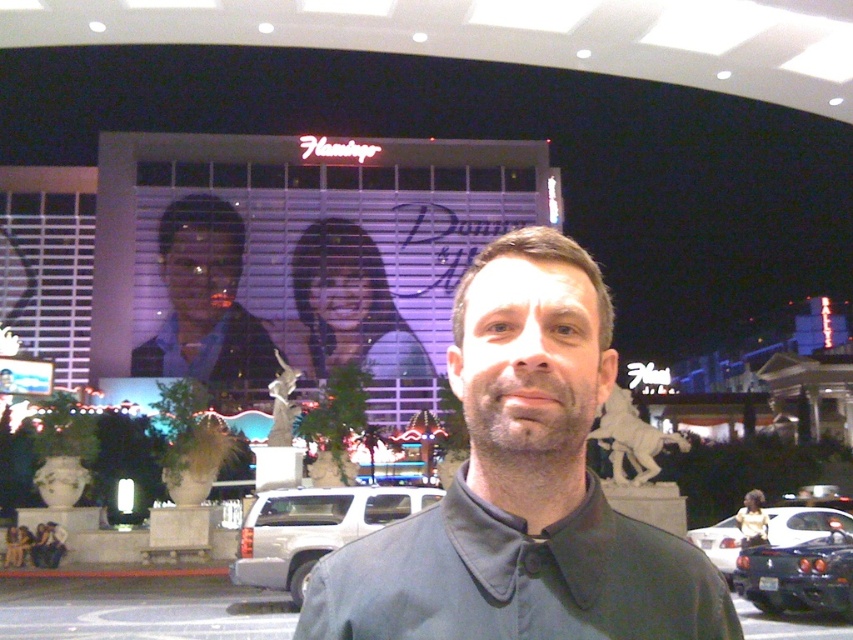
Who is positioned more to the right, black matte shirt at center or dark gray cotton dress shirt at center?

Positioned to the right is black matte shirt at center.

Does black matte shirt at center have a greater width compared to dark gray cotton dress shirt at center?

Yes, black matte shirt at center is wider than dark gray cotton dress shirt at center.

Which is in front, point (538, 552) or point (645, 616)?

Positioned in front is point (538, 552).

I want to click on black matte shirt at center, so 521,488.

Between point (561, 260) and point (212, 307), which one is positioned in front?

Point (561, 260) is more forward.

Is black matte shirt at center smaller than matte black man at center?

No, black matte shirt at center is not smaller than matte black man at center.

This screenshot has height=640, width=853. Identify the location of black matte shirt at center. (521, 488).

Can you confirm if dark gray cotton dress shirt at center is smaller than matte black man at center?

Correct, dark gray cotton dress shirt at center occupies less space than matte black man at center.

In the scene shown: Which is more to the right, dark gray cotton dress shirt at center or matte black man at center?

dark gray cotton dress shirt at center is more to the right.

Is point (712, 616) positioned behind point (161, 268)?

No.

Locate an element on the screen. The width and height of the screenshot is (853, 640). dark gray cotton dress shirt at center is located at coordinates (515, 579).